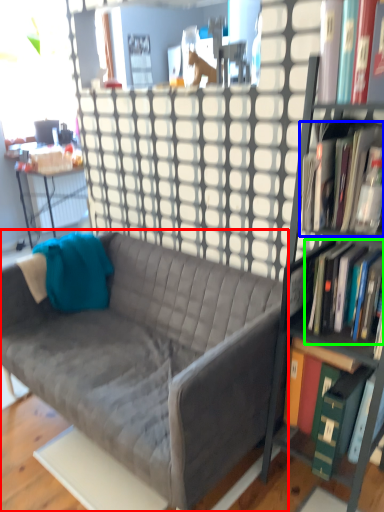
Question: Which object is positioned closest to studio couch (highlighted by a red box)? Select from book (highlighted by a blue box) and book (highlighted by a green box).

Choices:
 (A) book
 (B) book

Answer: (B)